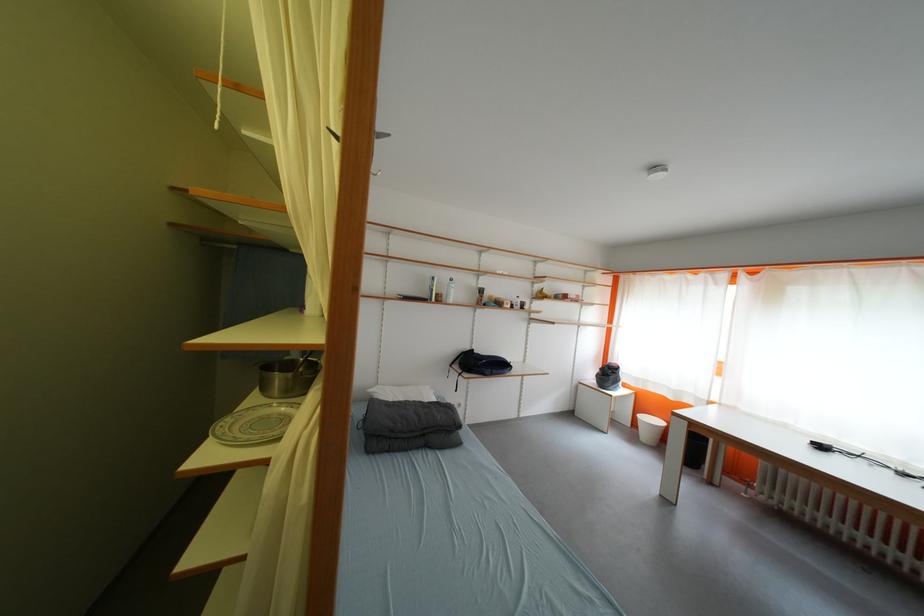
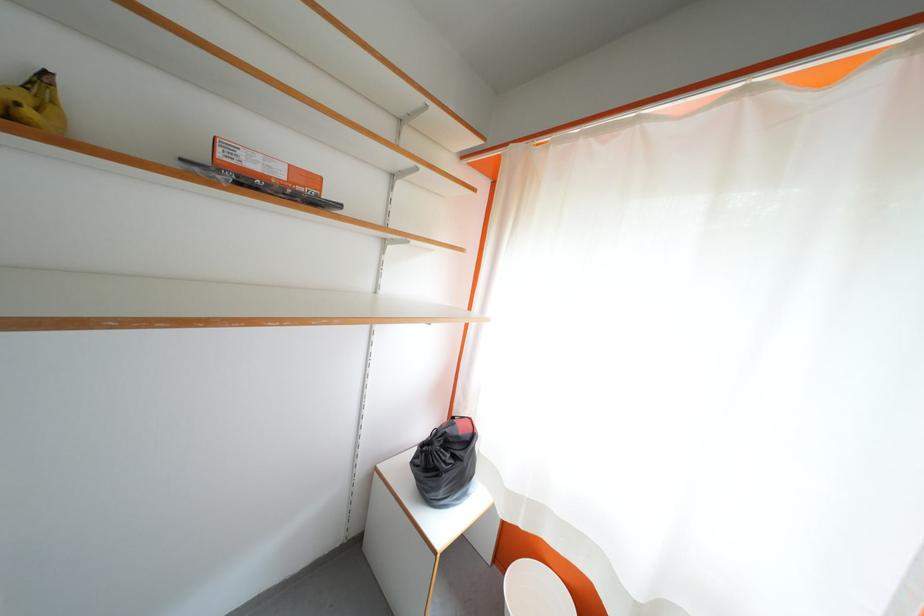
Looking at this image, in a continuous first-person perspective shot, in which direction is the camera moving?

The cameraman moved toward right, forward.